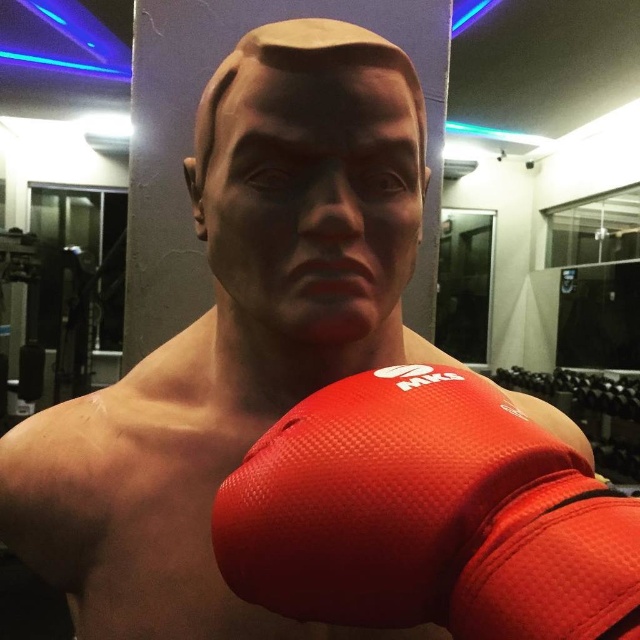
Question: Does red mesh boxing glove at center have a lesser width compared to matte black face at center?

Choices:
 (A) yes
 (B) no

Answer: (B)

Question: Which point is closer to the camera?

Choices:
 (A) (467, 536)
 (B) (259, 228)

Answer: (A)

Question: Which point is farther from the camera taking this photo?

Choices:
 (A) (236, 88)
 (B) (472, 547)

Answer: (A)

Question: Among these points, which one is nearest to the camera?

Choices:
 (A) (280, 288)
 (B) (520, 449)

Answer: (B)

Question: Does red mesh boxing glove at center have a greater width compared to matte black face at center?

Choices:
 (A) no
 (B) yes

Answer: (B)

Question: Does red mesh boxing glove at center have a lesser width compared to matte black face at center?

Choices:
 (A) yes
 (B) no

Answer: (B)